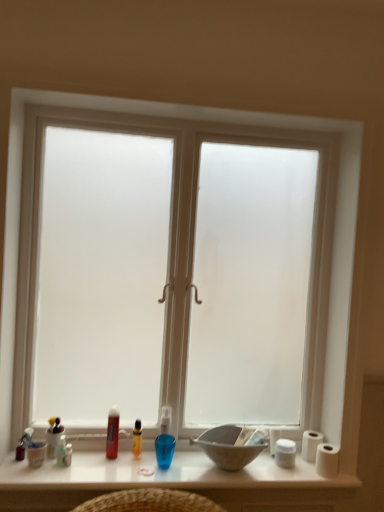
What are the coordinates of `free space to the right of translucent plastic container at lower left, positioned as the 1th toiletry in left-to-right order` in the screenshot? It's located at (86, 460).